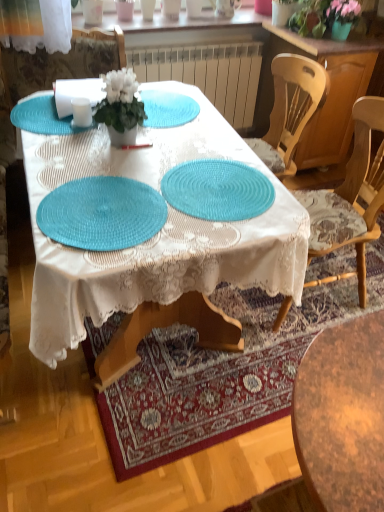
Find the location of a particular element. The image size is (384, 512). free space behind teal woven placemat at center, the 1th glass plate ordered from the bottom is located at coordinates (124, 159).